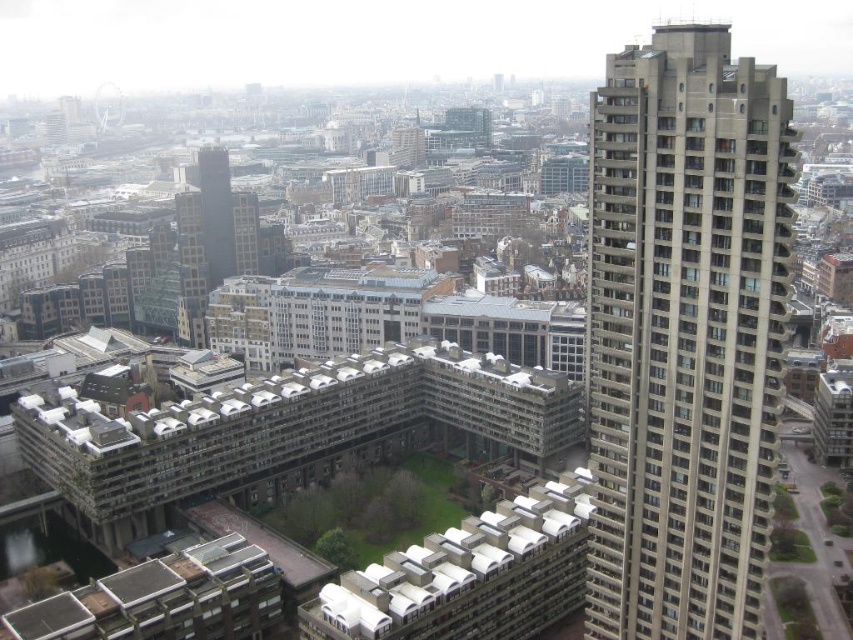
You are a city planner reviewing an aerial map of the city. You need to determine the exact coordinates of the gray concrete building at right for zoning purposes. What are its coordinates?

The gray concrete building at right is located at coordinates point (683,333).